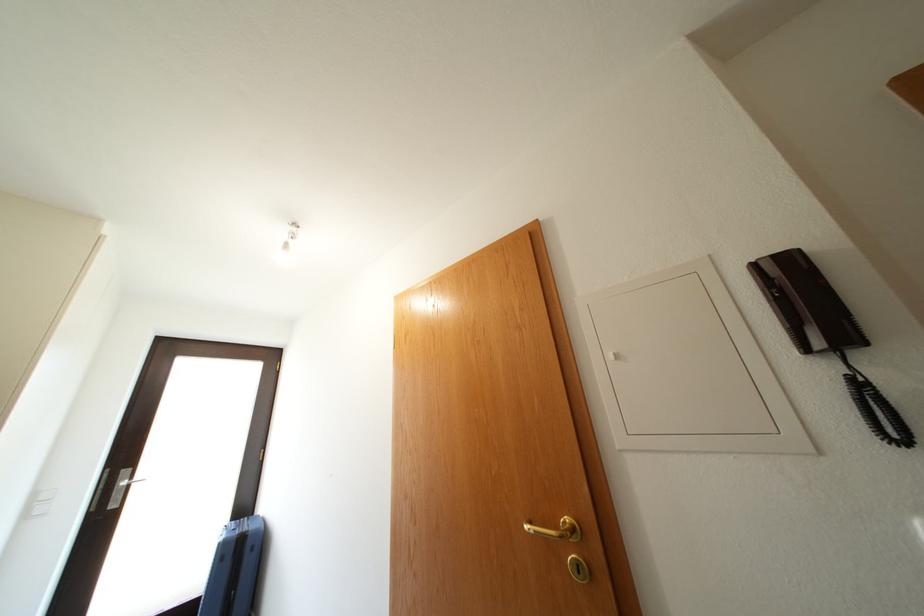
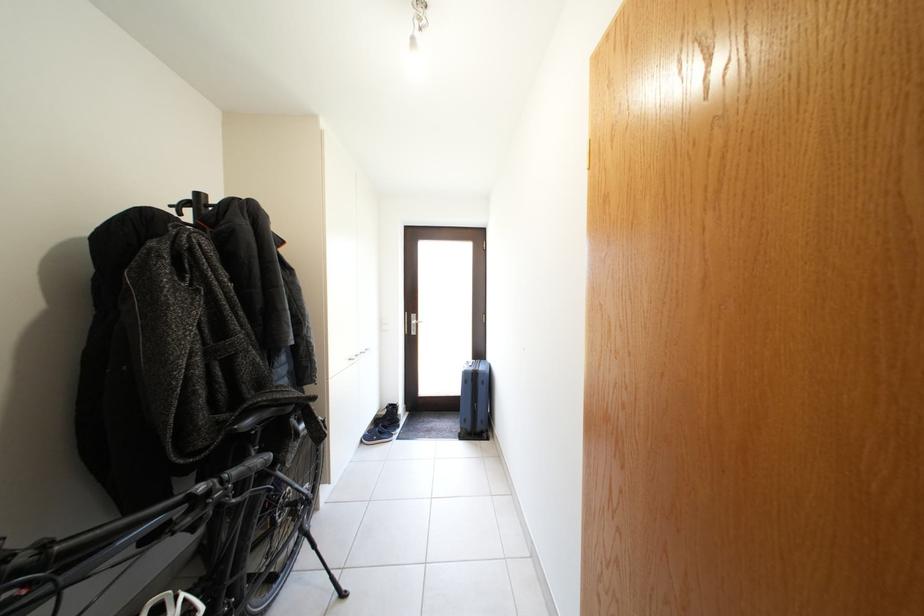
Find the pixel in the second image that matches the point at 134,477 in the first image.

(421, 322)